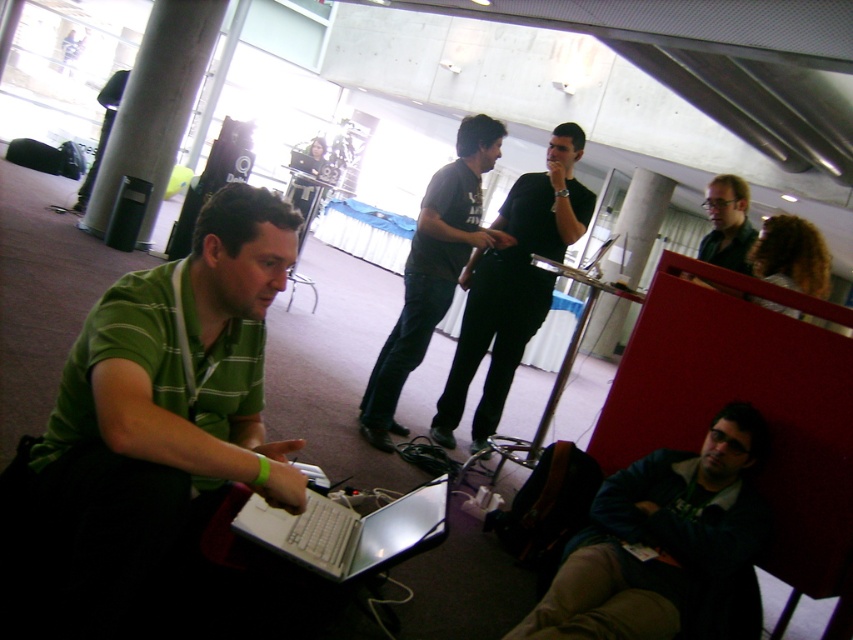
Is dark blue jacket at lower right positioned at the back of matte black shirt at upper right?

No.

Who is more forward, (706,486) or (730,243)?

Point (706,486) is more forward.

Locate an element on the screen. The height and width of the screenshot is (640, 853). dark blue jacket at lower right is located at coordinates (665, 545).

This screenshot has width=853, height=640. Describe the element at coordinates (158, 417) in the screenshot. I see `green striped shirt at left` at that location.

Is green striped shirt at left thinner than white glossy pillar at center?

Yes, green striped shirt at left is thinner than white glossy pillar at center.

Is point (96, 592) less distant than point (633, 179)?

Yes.

I want to click on green striped shirt at left, so click(158, 417).

Is curly hair at upper right to the right of matte black shirt at upper right from the viewer's perspective?

Indeed, curly hair at upper right is positioned on the right side of matte black shirt at upper right.

Between point (795, 259) and point (717, 256), which one is positioned behind?

The point (717, 256) is more distant.

Is point (816, 244) in front of point (740, 227)?

Yes, point (816, 244) is closer to viewer.

This screenshot has height=640, width=853. Identify the location of curly hair at upper right. (791, 256).